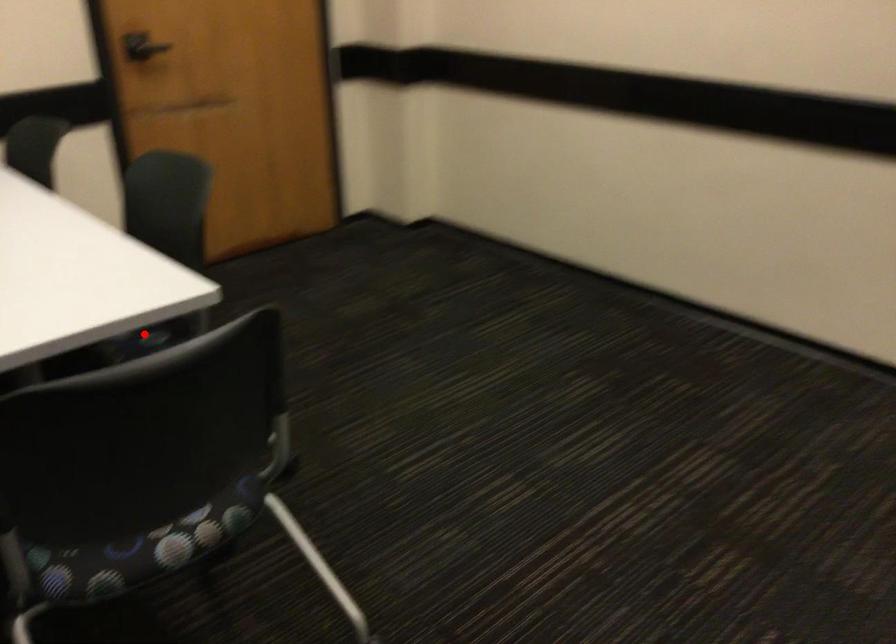
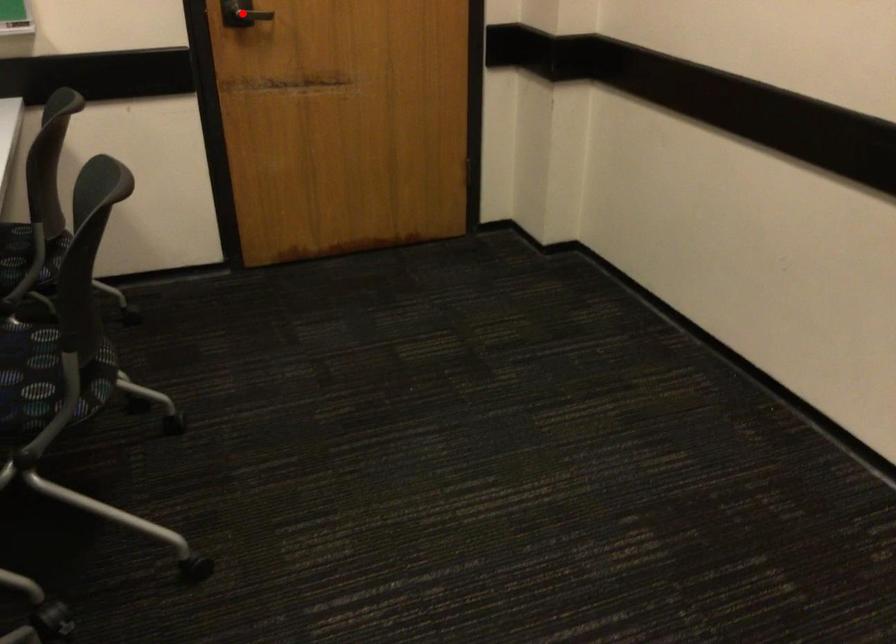
I am providing you with two images of the same scene from different viewpoints. A red point is marked on the first image and another point is marked on the second image. Is the marked point in image1 the same physical position as the marked point in image2?

No